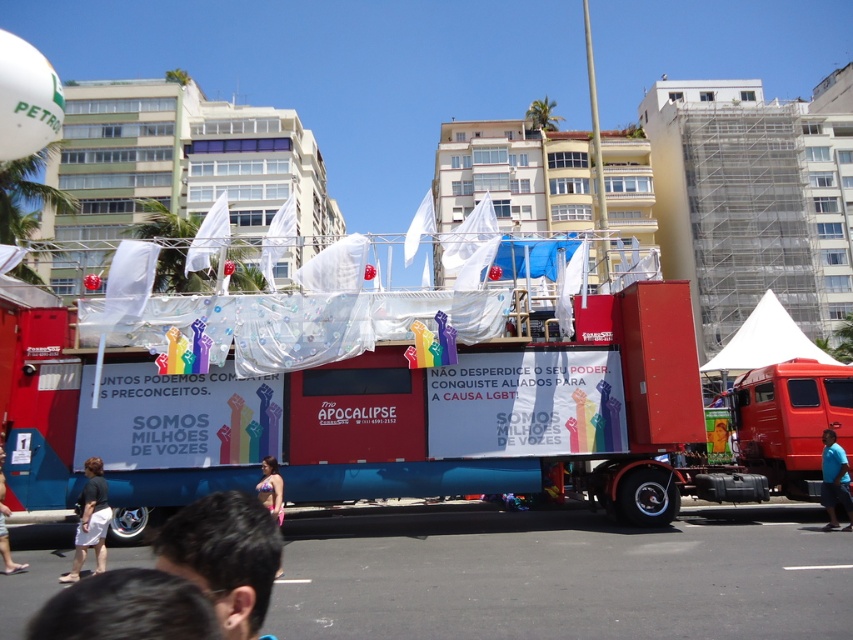
Question: Based on their relative distances, which object is farther from the dark brown hair at lower left?

Choices:
 (A) green fabric person at center
 (B) white fabric canopy at center
 (C) white cotton shorts at lower left
 (D) dark hair at lower center

Answer: (B)

Question: Is dark hair at lower center positioned at the back of white fabric canopy at center?

Choices:
 (A) yes
 (B) no

Answer: (B)

Question: Which point is closer to the camera taking this photo?

Choices:
 (A) (822, 467)
 (B) (721, 445)

Answer: (A)

Question: Does dark brown hair at lower left have a smaller size compared to pink fabric bikini at lower center?

Choices:
 (A) yes
 (B) no

Answer: (B)

Question: Is white fabric canopy at center positioned at the back of white cotton shorts at lower left?

Choices:
 (A) yes
 (B) no

Answer: (A)

Question: Based on their relative distances, which object is nearer to the matte red truck at center?

Choices:
 (A) black cotton shorts at lower left
 (B) pink fabric bikini at lower center

Answer: (A)